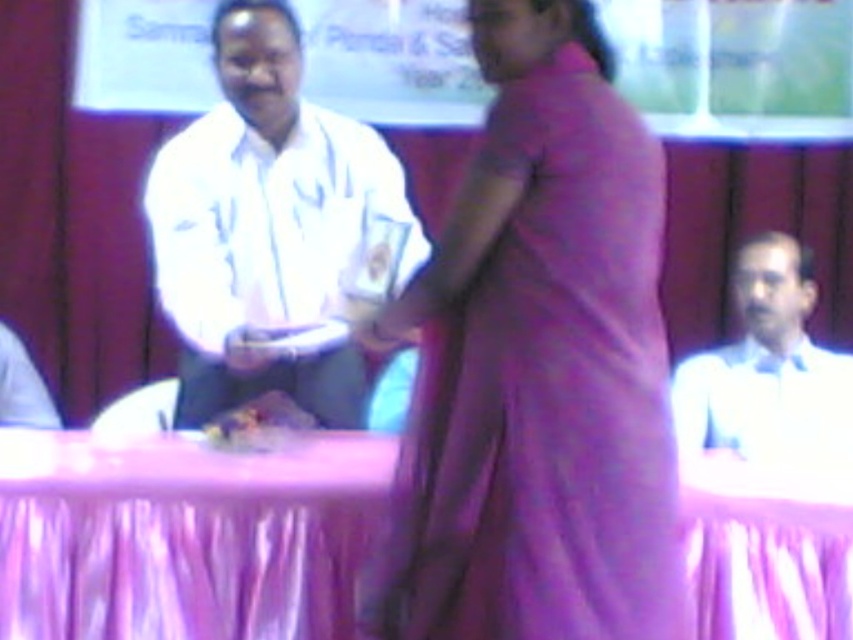
Is white glossy shirt at center positioned behind white shirt at right?

That is True.

Does white glossy shirt at center have a greater width compared to white shirt at right?

No.

What do you see at coordinates (267, 224) in the screenshot?
I see `white glossy shirt at center` at bounding box center [267, 224].

I want to click on white glossy shirt at center, so click(x=267, y=224).

Between white shirt at right and smooth plastic food at center, which one is positioned lower?

smooth plastic food at center

Between white shirt at right and smooth plastic food at center, which one has less height?

With less height is smooth plastic food at center.

Where is `white shirt at right`? The width and height of the screenshot is (853, 640). white shirt at right is located at coordinates (769, 371).

Between purple fabric dress at center and white shirt at right, which one appears on the left side from the viewer's perspective?

Result: From the viewer's perspective, purple fabric dress at center appears more on the left side.

How distant is purple fabric dress at center from white shirt at right?

purple fabric dress at center is 3.67 feet from white shirt at right.

Who is more forward, [608,429] or [793,237]?

Point [608,429]

Identify the location of purple fabric dress at center. This screenshot has width=853, height=640. (538, 368).